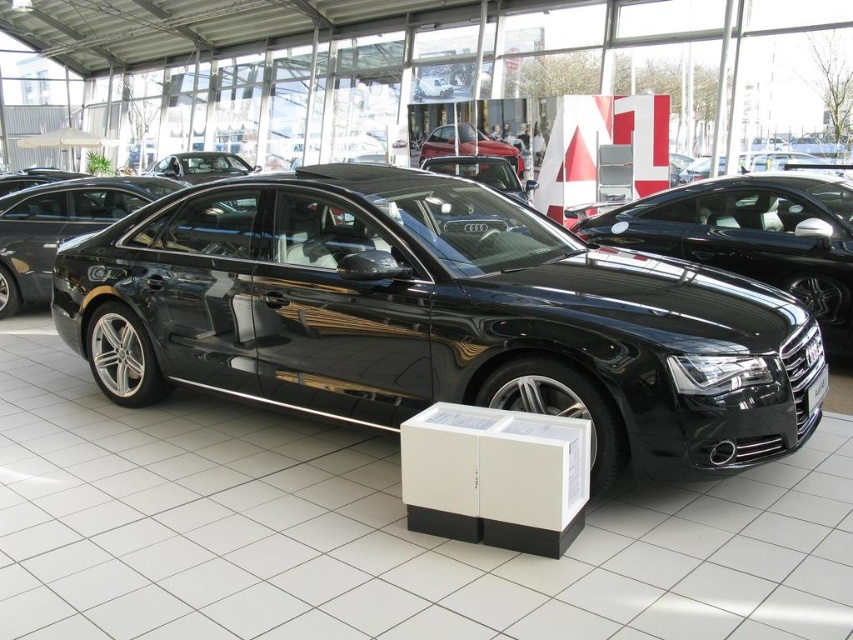
Question: Which point is closer to the camera?

Choices:
 (A) glossy metallic car at center
 (B) black metallic license plate at center
 (C) glossy black sedan at center
 (D) glossy black car at center

Answer: (C)

Question: Which object appears farthest from the camera in this image?

Choices:
 (A) glossy black car at center
 (B) black metallic license plate at center

Answer: (A)

Question: Does glossy black sedan at center have a larger size compared to black metallic license plate at center?

Choices:
 (A) yes
 (B) no

Answer: (A)

Question: Does glossy black car at center appear under black metallic license plate at center?

Choices:
 (A) no
 (B) yes

Answer: (A)

Question: Can you confirm if glossy black sedan at center is smaller than glossy metallic car at center?

Choices:
 (A) yes
 (B) no

Answer: (B)

Question: Which object is closer to the camera taking this photo?

Choices:
 (A) black metallic license plate at center
 (B) glossy black car at center
 (C) glossy black sedan at center

Answer: (C)